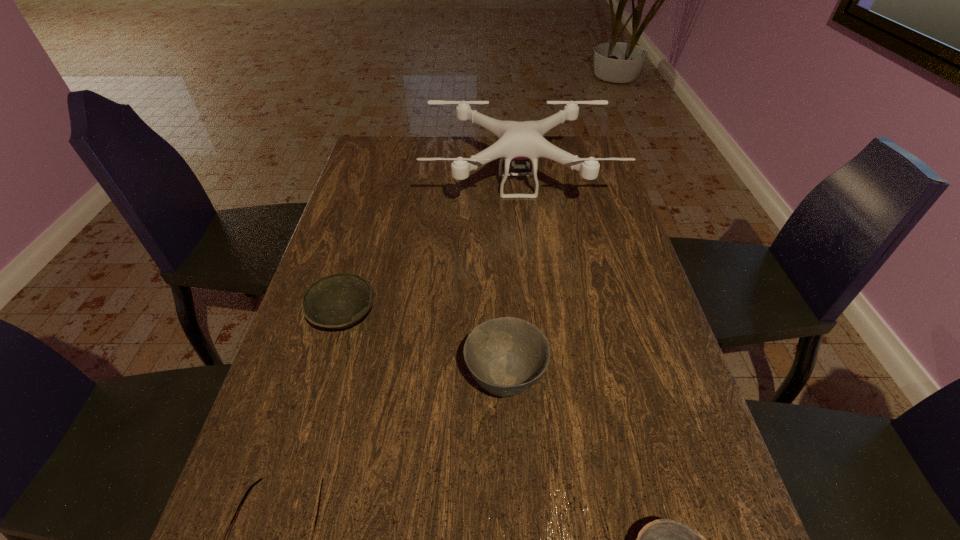
Where is `object located at the left edge`? The width and height of the screenshot is (960, 540). object located at the left edge is located at coordinates (336, 301).

Identify the location of object that is at the right edge. (517, 140).

The image size is (960, 540). Find the location of `object located in the far right corner section of the desktop`. object located in the far right corner section of the desktop is located at coordinates (517, 140).

Locate an element on the screen. The width and height of the screenshot is (960, 540). free space at the far edge is located at coordinates pos(431,165).

I want to click on free space at the left edge of the desktop, so click(319, 277).

In the image, there is a desktop. Identify the location of vacant space at the right edge. Image resolution: width=960 pixels, height=540 pixels. (632, 375).

In the image, there is a desktop. Where is `vacant space at the far left corner`? vacant space at the far left corner is located at coordinates (405, 145).

Identify the location of free space between the tallest object and the fourth nearest object. (431, 252).

Locate an element on the screen. The height and width of the screenshot is (540, 960). object that can be found as the third closest to the farthest bowl is located at coordinates (259, 480).

Select which object is the second closest to the third tallest object. Please provide its 2D coordinates. Your answer should be formatted as a tuple, i.e. [(x, y)], where the tuple contains the x and y coordinates of a point satisfying the conditions above.

[(517, 140)]